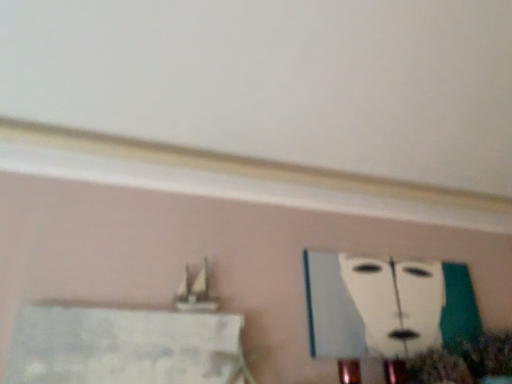
This screenshot has width=512, height=384. What do you see at coordinates (396, 303) in the screenshot?
I see `white matte painting at upper center` at bounding box center [396, 303].

This screenshot has height=384, width=512. Find the location of `white matte painting at upper center`. white matte painting at upper center is located at coordinates click(396, 303).

In order to face white matte painting at upper center, should I rotate leftwards or rightwards?

You should look right and rotate roughly 19.112 degrees.

At what (x,y) coordinates should I click in order to perform the action: click on white matte painting at upper center. Please return your answer as a coordinate pair (x, y). Looking at the image, I should click on tap(396, 303).